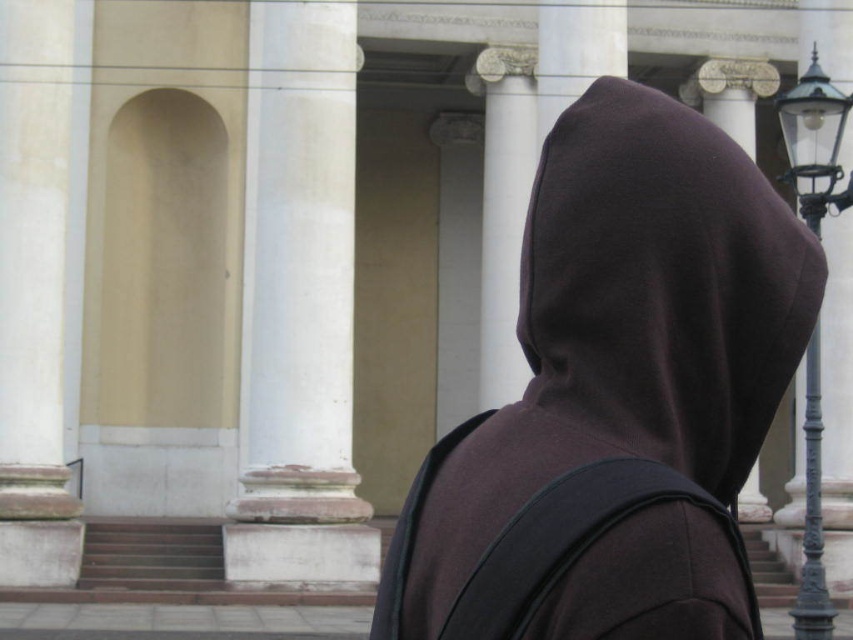
Question: Which point is closer to the camera taking this photo?

Choices:
 (A) (254, 49)
 (B) (724, 420)

Answer: (B)

Question: Is brown fleece hood at center below polished brass lamp post at right?

Choices:
 (A) yes
 (B) no

Answer: (B)

Question: Can you confirm if white marble column at center is positioned below polished brass lamp post at right?

Choices:
 (A) no
 (B) yes

Answer: (A)

Question: Considering the relative positions of brown fleece hood at center and white marble column at center in the image provided, where is brown fleece hood at center located with respect to white marble column at center?

Choices:
 (A) left
 (B) right

Answer: (B)

Question: Which object is the closest to the polished brass lamp post at right?

Choices:
 (A) white marble column at center
 (B) brown fleece hood at center

Answer: (B)

Question: Which is farther from the polished brass lamp post at right?

Choices:
 (A) brown fleece hood at center
 (B) white marble column at center

Answer: (B)